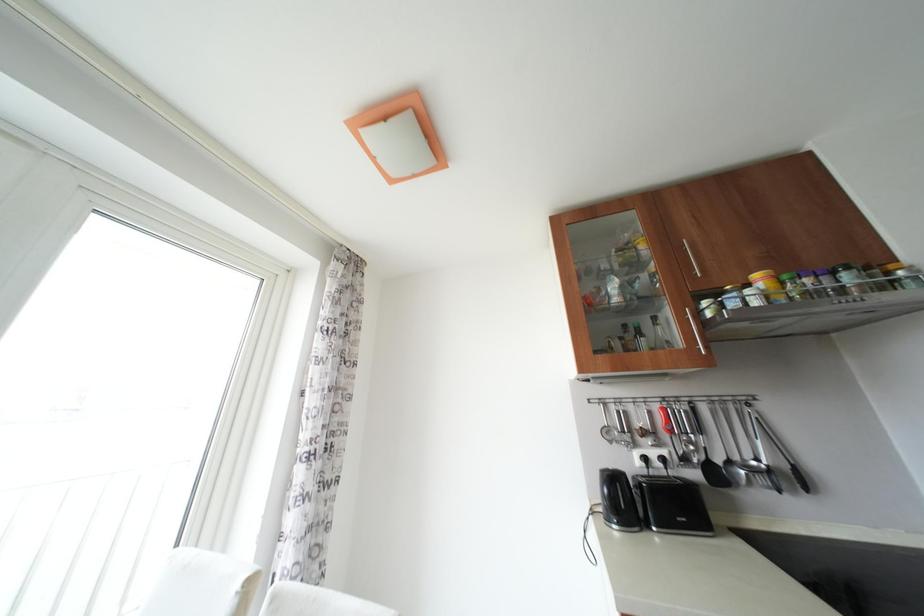
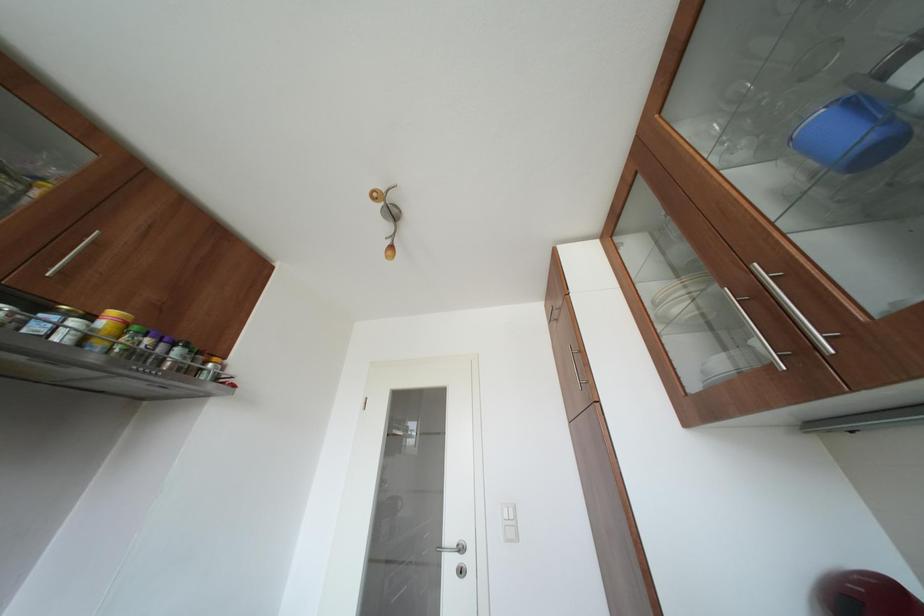
In the scene shown: The images are taken continuously from a first-person perspective. In which direction is your viewpoint rotating?

The rotation direction of the camera is right-up.